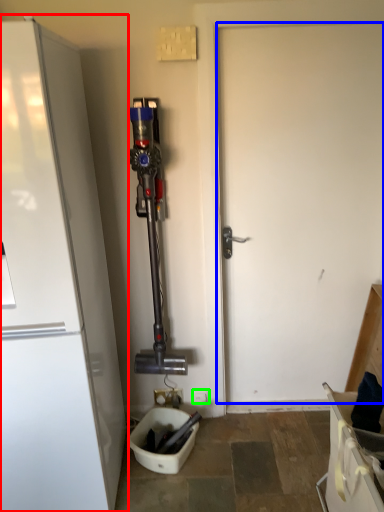
Question: Considering the real-world distances, which object is farthest from refrigerator (highlighted by a red box)? door (highlighted by a blue box) or electric outlet (highlighted by a green box)?

Choices:
 (A) door
 (B) electric outlet

Answer: (B)